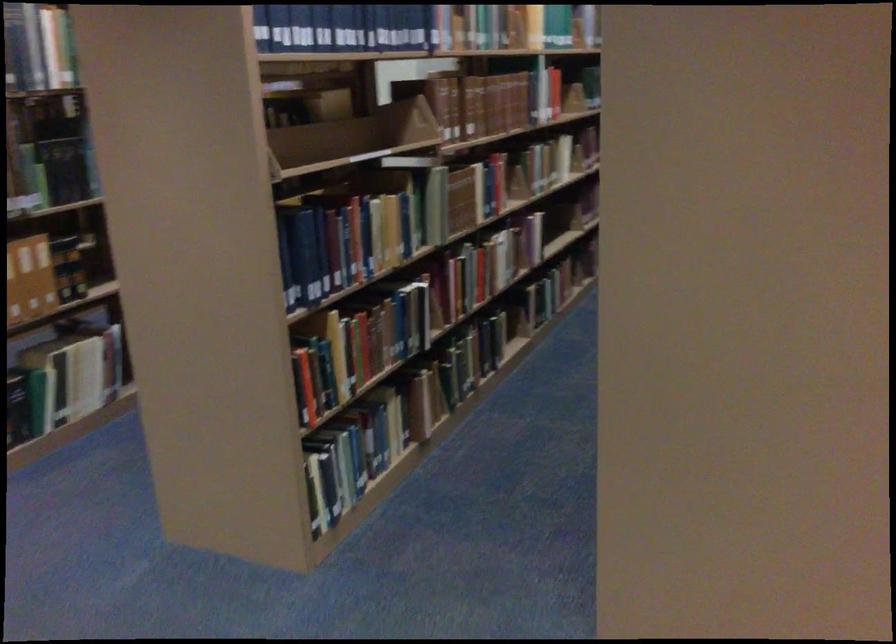
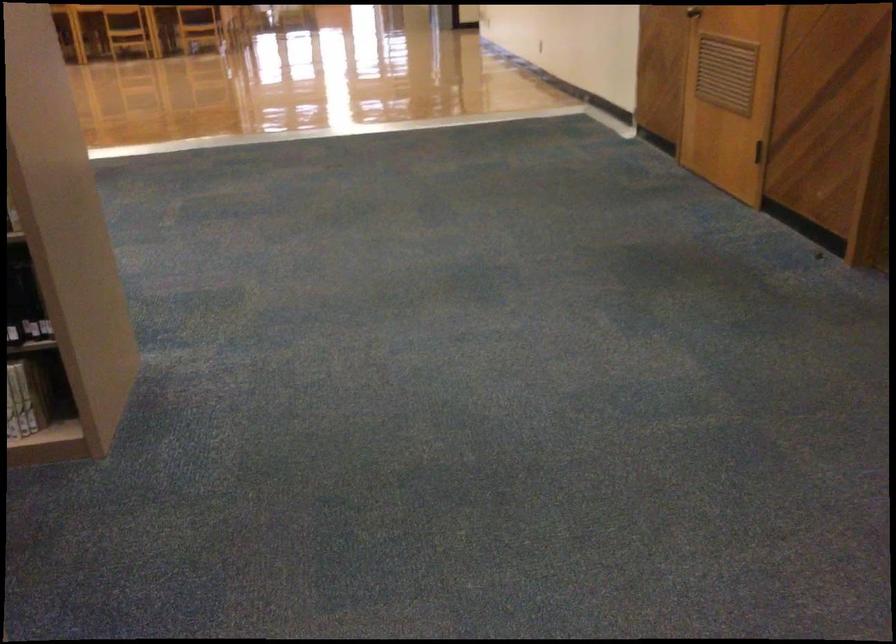
Locate, in the second image, the point that corresponds to point 652,526 in the first image.

(27, 399)